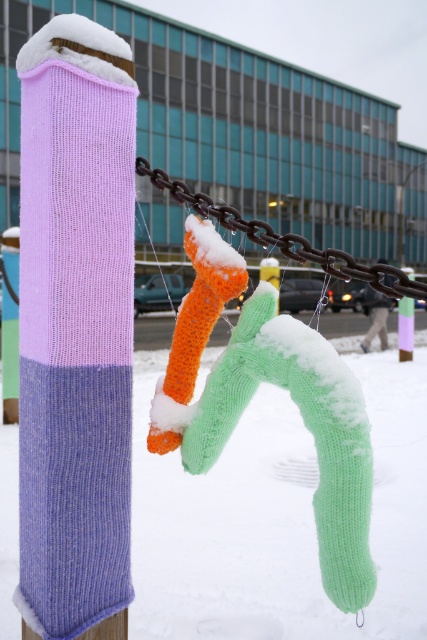
You are an artist planning to add a new decoration to the winter installation. You have a small snow globe that you want to hang between the green knitted sock at center and the rusty metal chain at center. Based on their positions, where should you place the snow globe?

The green knitted sock at center is to the left of the rusty metal chain at center, so you should place the snow globe to the right of the green knitted sock at center and to the left of the rusty metal chain at center to position it between them.